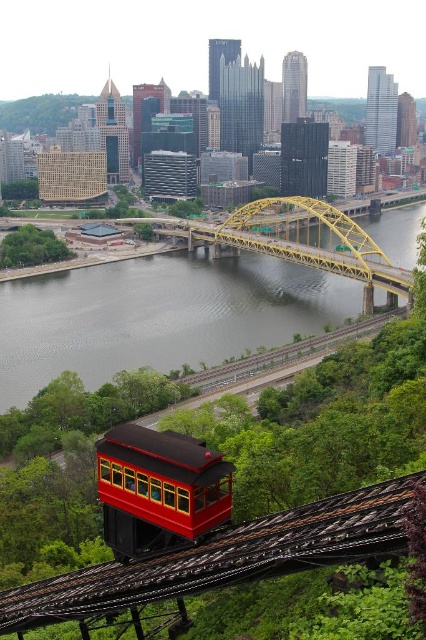
In the scene shown: Is shiny red trolley car at center behind yellow steel bridge at center?

No, shiny red trolley car at center is closer to the viewer.

Is point (118, 488) less distant than point (259, 209)?

That is True.

The height and width of the screenshot is (640, 426). In order to click on shiny red trolley car at center in this screenshot , I will do `click(158, 490)`.

Does gray concrete water at center have a lesser height compared to yellow steel bridge at center?

No, gray concrete water at center is not shorter than yellow steel bridge at center.

Who is more distant from viewer, (x=180, y=257) or (x=270, y=228)?

The point (x=270, y=228) is behind.

This screenshot has width=426, height=640. In order to click on gray concrete water at center in this screenshot , I will do `click(157, 316)`.

Does gray concrete water at center appear under shiny red trolley car at center?

Actually, gray concrete water at center is above shiny red trolley car at center.

Does gray concrete water at center appear over shiny red trolley car at center?

Indeed, gray concrete water at center is positioned over shiny red trolley car at center.

Image resolution: width=426 pixels, height=640 pixels. Describe the element at coordinates (157, 316) in the screenshot. I see `gray concrete water at center` at that location.

Find the location of a particular element. Image resolution: width=426 pixels, height=640 pixels. gray concrete water at center is located at coordinates (157, 316).